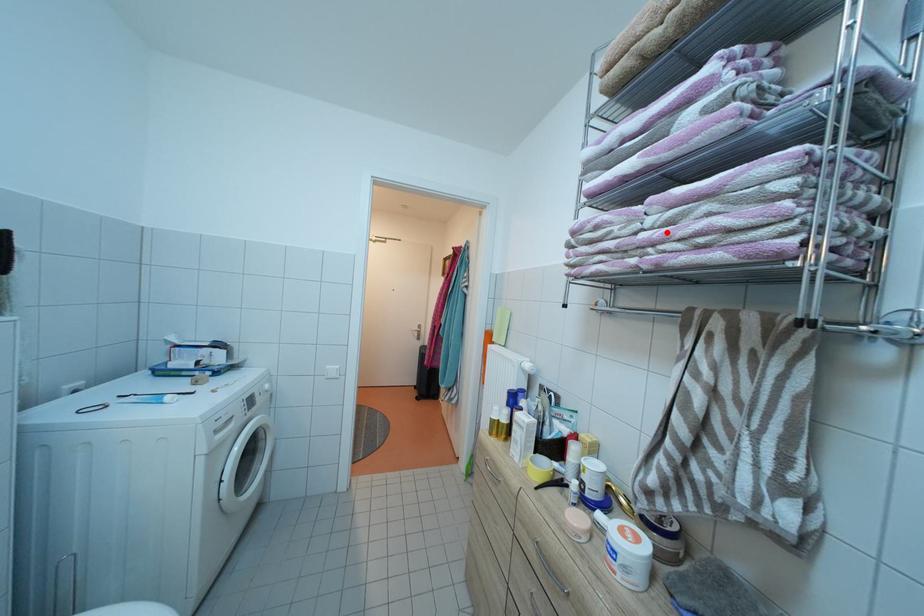
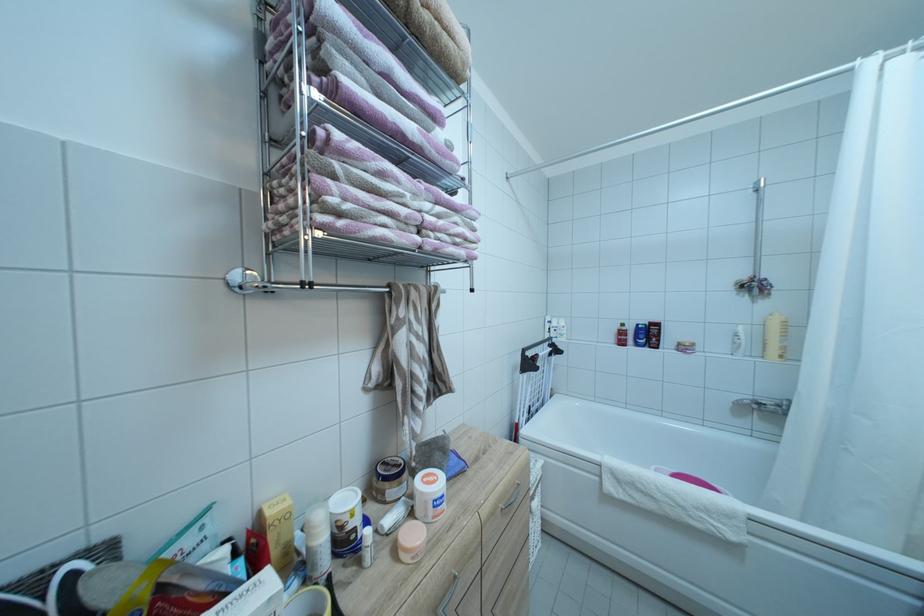
Find the pixel in the second image that matches the highlighted location in the first image.

(440, 221)